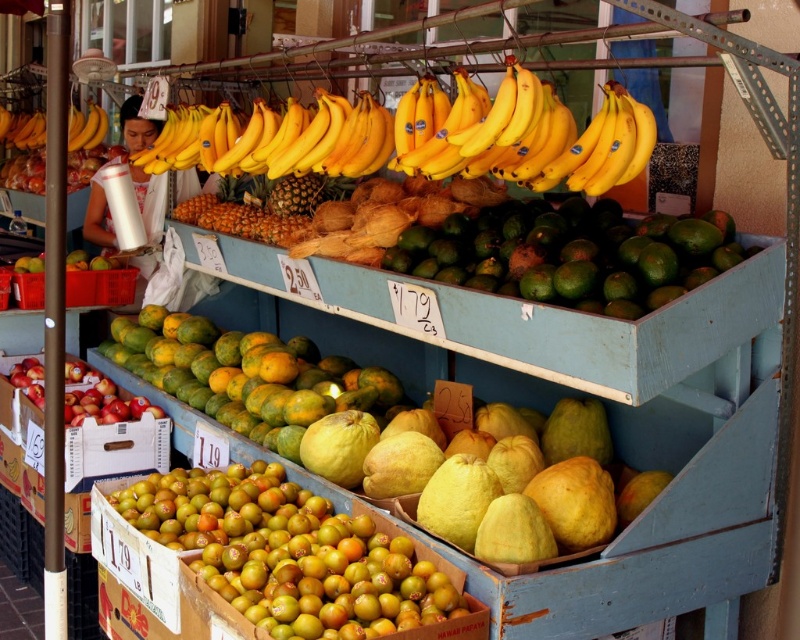
You are a customer at the fruit market stall. You see the green matte mangoes at center and the yellow matte bananas at upper center. Which fruit is located higher up in the stall?

The yellow matte bananas at upper center are located higher up in the stall than the green matte mangoes at center, which are positioned underneath them.

You are a customer at the fruit market. You want to buy a fruit that is taller than the other. Which one should you choose between the green matte papaya at center and the red matte apples at lower left?

The green matte papaya at center is much taller than the red matte apples at lower left, so you should choose the green matte papaya at center.